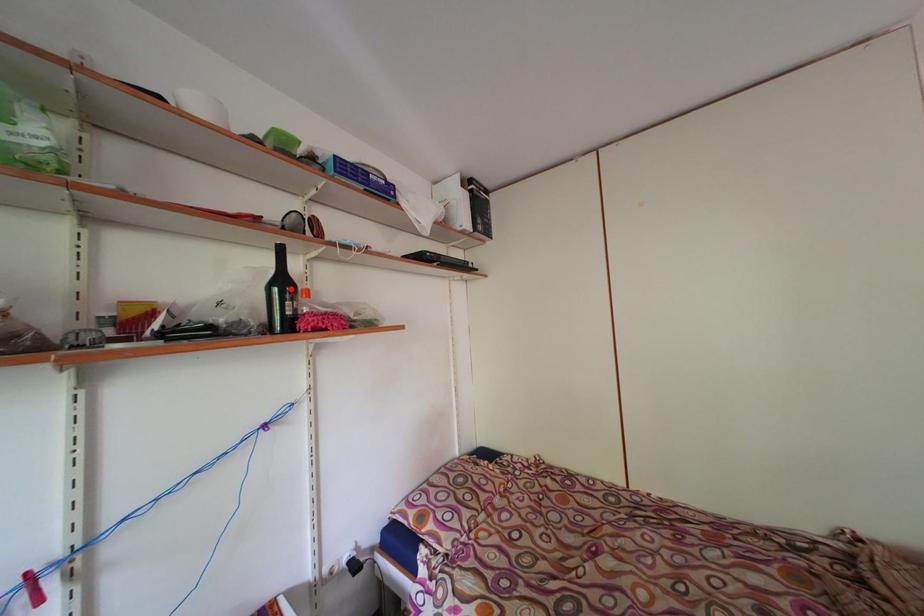
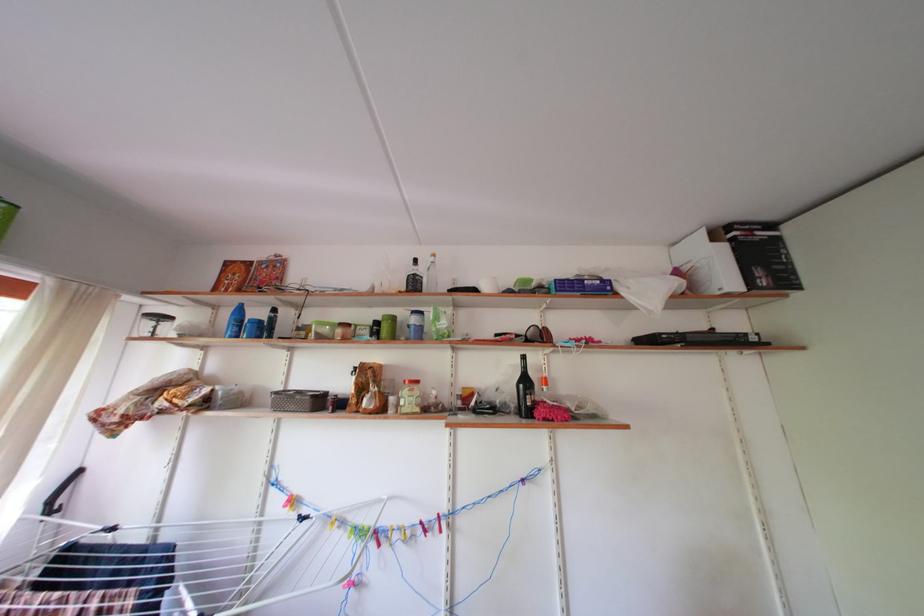
In the second image, find the point that corresponds to the highlighted location in the first image.

(533, 387)